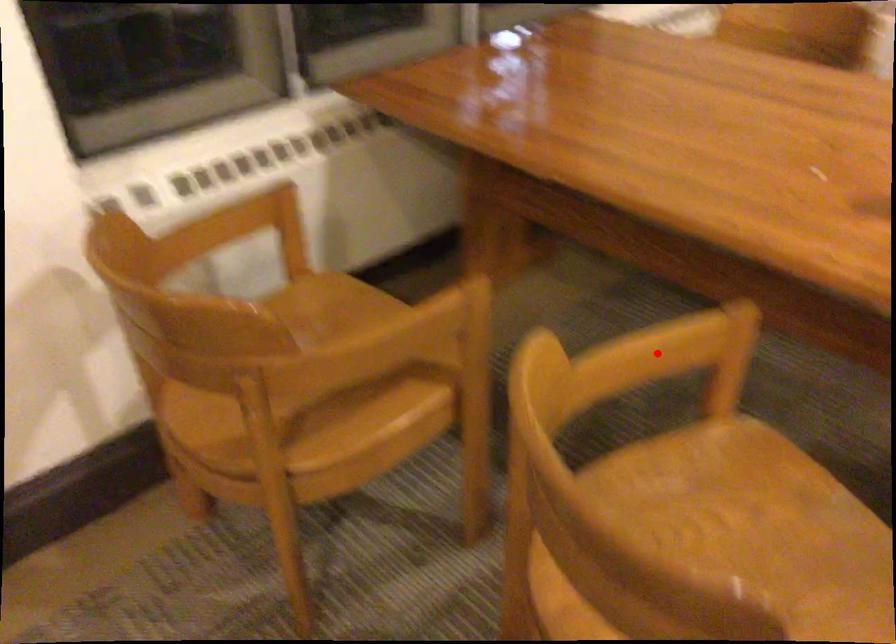
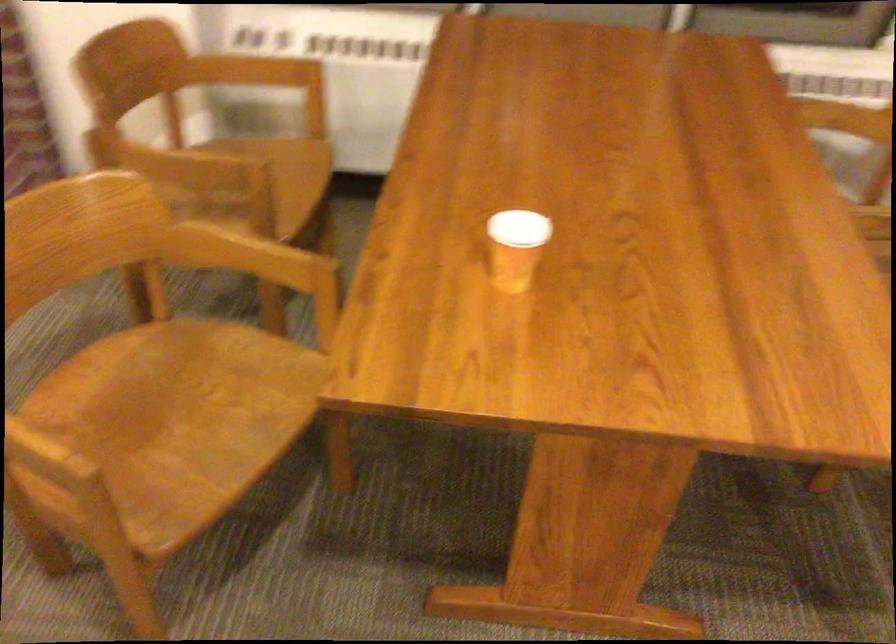
Locate, in the second image, the point that corresponds to the highlighted location in the first image.

(248, 257)